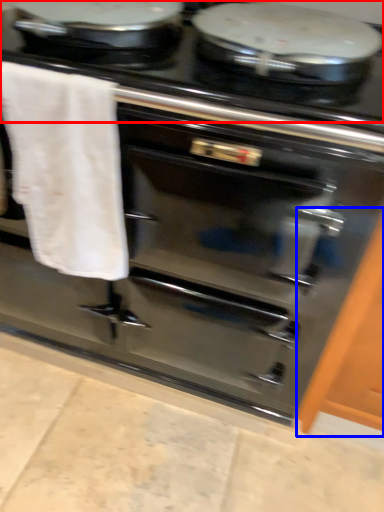
Question: Which object is further to the camera taking this photo, gas stove (highlighted by a red box) or cabinetry (highlighted by a blue box)?

Choices:
 (A) gas stove
 (B) cabinetry

Answer: (B)